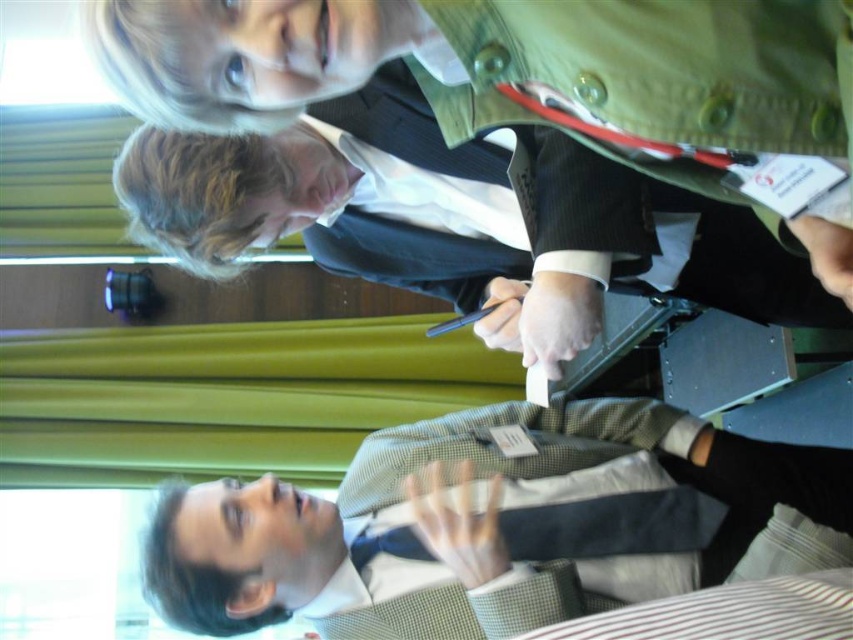
Question: Is checkered fabric shirt at lower center thinner than dark green textured jacket at upper center?

Choices:
 (A) no
 (B) yes

Answer: (A)

Question: Does checkered fabric shirt at lower center appear over dark green textured jacket at upper center?

Choices:
 (A) yes
 (B) no

Answer: (B)

Question: Which object is closer to the camera taking this photo?

Choices:
 (A) checkered fabric shirt at lower center
 (B) dark green textured jacket at upper center

Answer: (B)

Question: Is the position of checkered fabric shirt at lower center less distant than that of dark green textured jacket at upper center?

Choices:
 (A) yes
 (B) no

Answer: (B)

Question: Which of the following is the closest to the observer?

Choices:
 (A) (717, 548)
 (B) (453, 252)

Answer: (A)